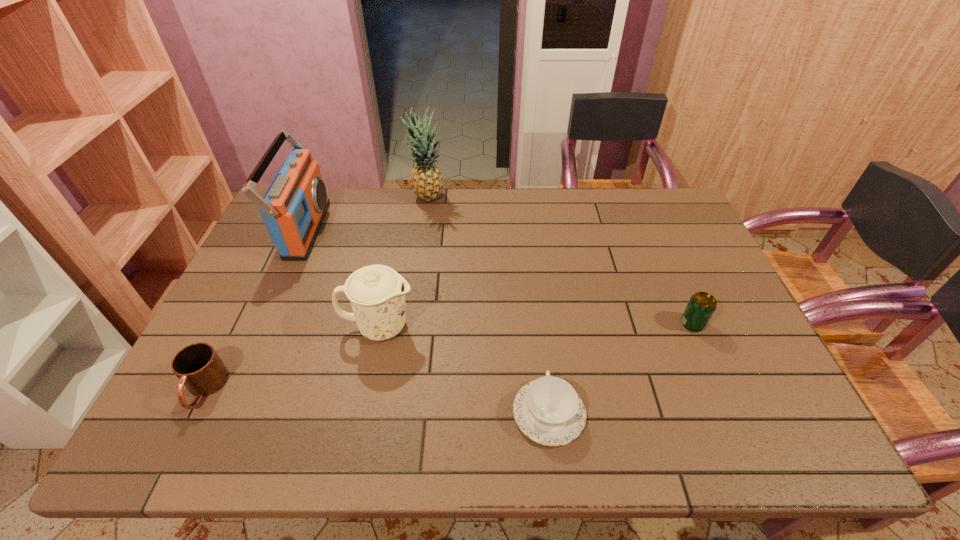
Find the location of a particular element. the tallest object is located at coordinates (427, 182).

Find the location of `radio receiver`. radio receiver is located at coordinates (293, 208).

The width and height of the screenshot is (960, 540). What are the coordinates of `the fourth shortest object` in the screenshot? It's located at (377, 293).

Identify the location of the left chinaware. (377, 293).

You are a GUI agent. You are given a task and a screenshot of the screen. Output one action in this format:
    pyautogui.click(x=<x>, y=<y>)
    Task: Click on the beer can
    
    Given the screenshot: What is the action you would take?
    pyautogui.click(x=701, y=306)

Image resolution: width=960 pixels, height=540 pixels. Find the location of `mug`. mug is located at coordinates (199, 368).

You are a GUI agent. You are given a task and a screenshot of the screen. Output one action in this format:
    pyautogui.click(x=<x>, y=<y>)
    Task: Click on the nearer chinaware
    The height and width of the screenshot is (540, 960).
    Given the screenshot: What is the action you would take?
    click(548, 410)

The image size is (960, 540). Find the location of `the second object from right to left`. the second object from right to left is located at coordinates (548, 410).

What are the coordinates of `vacant space situated 0.370m on the front of the tallest object` in the screenshot? It's located at (415, 285).

Identify the location of vacant region located on the front-facing side of the second tallest object. (350, 230).